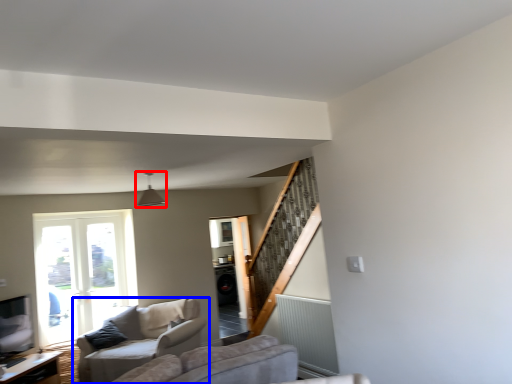
Question: Which of the following is the farthest to the observer, light fixture (highlighted by a red box) or studio couch (highlighted by a blue box)?

Choices:
 (A) light fixture
 (B) studio couch

Answer: (B)